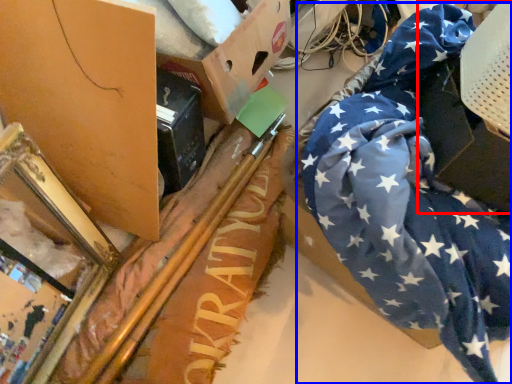
Question: Which of the following is the farthest to the observer, cardboard box (highlighted by a red box) or flag (highlighted by a blue box)?

Choices:
 (A) cardboard box
 (B) flag

Answer: (A)